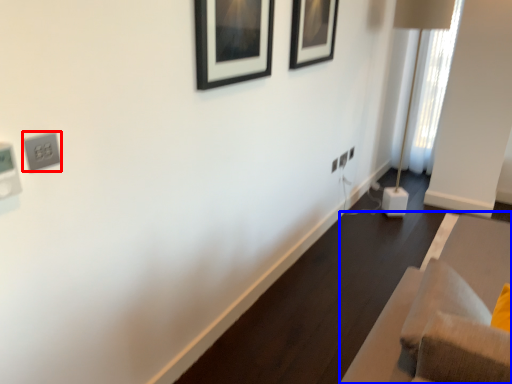
Question: Which point is closer to the camera, electric outlet (highlighted by a red box) or furniture (highlighted by a blue box)?

Choices:
 (A) electric outlet
 (B) furniture

Answer: (B)